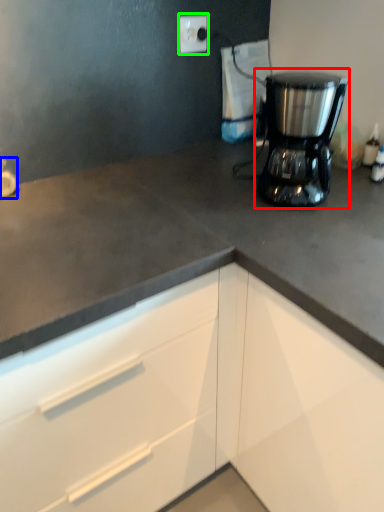
Question: Which is farther away from home appliance (highlighted by a red box)? faucet (highlighted by a blue box) or electric outlet (highlighted by a green box)?

Choices:
 (A) faucet
 (B) electric outlet

Answer: (A)